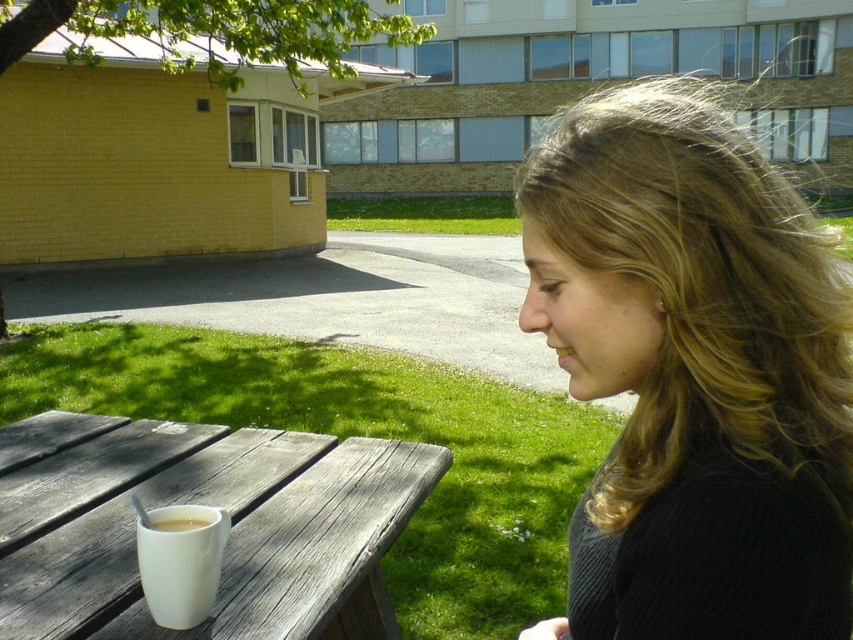
You are planning to place a small vase on the white wood table at lower left. However, there is already a white matte mug at table left on the table. Where should you place the vase to ensure it doesn t fall off the table?

The white wood table at lower left is located below the white matte mug at table left, so placing the vase below the mug would keep it on the table and prevent it from falling off.

You are a photographer trying to capture the scene of the woman and the table. To ensure both the dark brown hair at right and the white wood table at lower left are in focus, where should you position your camera relative to the subjects?

The dark brown hair at right is located above the white wood table at lower left, so positioning the camera at eye level or slightly above the table would ensure both are in focus.